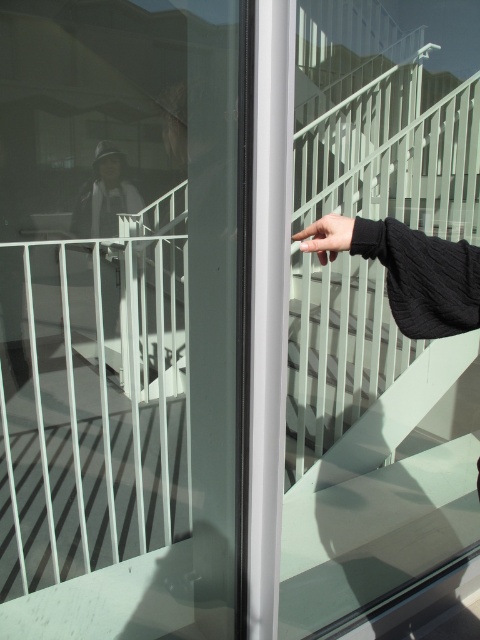
Who is positioned more to the left, transparent glass screen door at center or black matte hand at center?

transparent glass screen door at center is more to the left.

Is point (173, 227) positioned after point (313, 250)?

Yes, it is behind point (313, 250).

This screenshot has width=480, height=640. Find the location of `transparent glass screen door at center`. transparent glass screen door at center is located at coordinates (118, 288).